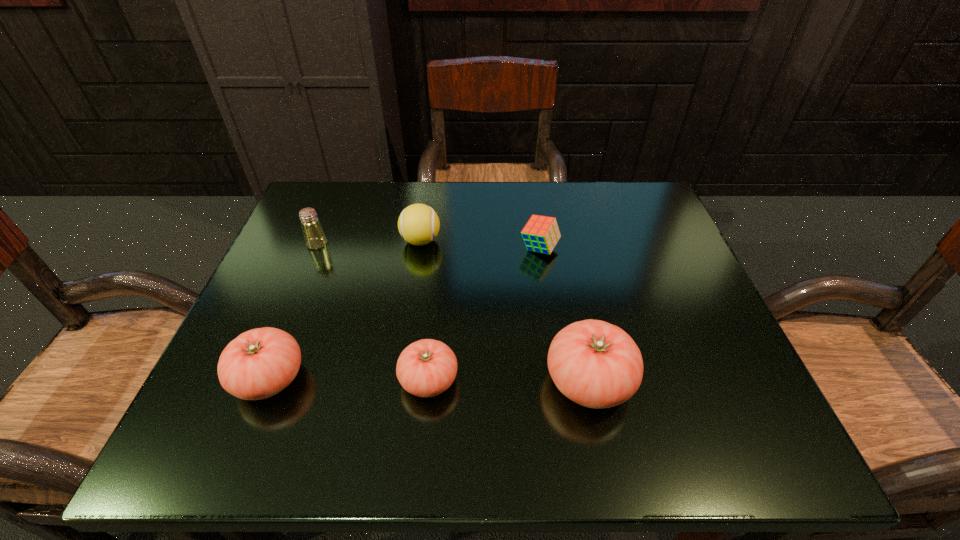
Identify the location of vacant space located on the left of the cube. This screenshot has width=960, height=540. (492, 248).

Where is `vacant region located 0.390m on the right of the tennis ball`? vacant region located 0.390m on the right of the tennis ball is located at coordinates (612, 241).

The height and width of the screenshot is (540, 960). In order to click on vacant area situated on the back of the saltshaker in this screenshot , I will do `click(342, 184)`.

The width and height of the screenshot is (960, 540). What are the coordinates of `cube present at the far edge` in the screenshot? It's located at (541, 233).

Identify the location of tennis ball positioned at the far edge. (418, 224).

Find the location of a particular element. saltshaker that is at the far edge is located at coordinates (315, 238).

The width and height of the screenshot is (960, 540). In order to click on tomato located at the left edge in this screenshot , I will do `click(259, 363)`.

The width and height of the screenshot is (960, 540). Find the location of `saltshaker that is positioned at the left edge`. saltshaker that is positioned at the left edge is located at coordinates (315, 238).

Where is `object located at the far left corner`? Image resolution: width=960 pixels, height=540 pixels. object located at the far left corner is located at coordinates (315, 238).

Find the location of a particular element. object present at the near left corner is located at coordinates (259, 363).